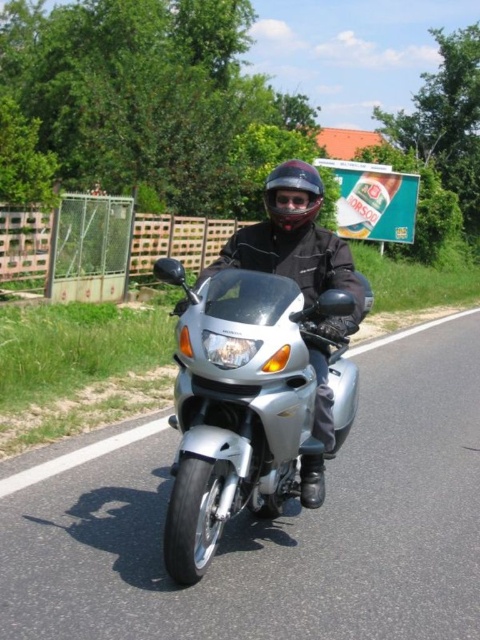
Question: Which point is farther to the camera?

Choices:
 (A) matte black helmet at center
 (B) silver metallic motorbike at center

Answer: (A)

Question: Which point is closer to the camera taking this photo?

Choices:
 (A) (289, 170)
 (B) (292, 476)

Answer: (A)

Question: Does silver metallic motorcycle at center appear on the left side of silver metallic motorbike at center?

Choices:
 (A) yes
 (B) no

Answer: (A)

Question: In this image, where is silver metallic motorcycle at center located relative to matte black helmet at center?

Choices:
 (A) left
 (B) right

Answer: (A)

Question: Is silver metallic motorbike at center closer to camera compared to glossy plastic goggles at center?

Choices:
 (A) no
 (B) yes

Answer: (B)

Question: Which point is closer to the camera?

Choices:
 (A) (458, 616)
 (B) (278, 200)
 (C) (287, 227)

Answer: (A)